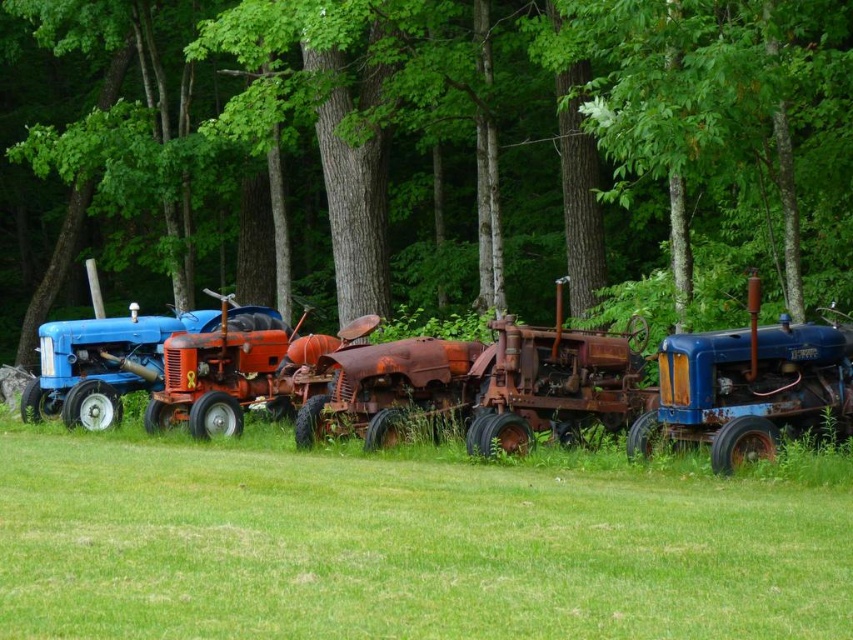
You are a farmer who needs to choose a tractor to plow a narrow field. You have two options in the image, the rusty metal tractor at center and the blue matte tractor at right. Which tractor would you select based on their widths?

The rusty metal tractor at center is thinner than the blue matte tractor at right, so the rusty metal tractor at center would be the better choice for plowing the narrow field as it can fit through tighter spaces.

You are standing in the middle of the grassy area surrounded by trees and looking at the vintage tractors. There are two points marked in the scene, point A at coordinates point (78, 74) and point B at coordinates point (514, 435). Which point is closer to you?

Point A at coordinates point (78, 74) is closer to you because it is further to the camera than point B at coordinates point (514, 435).

You are a farmer who needs to choose between the rusty metal tractor at center and the blue matte tractor at right for a task that requires a taller vehicle. Which tractor should you choose?

The blue matte tractor at right is taller than the rusty metal tractor at center, so you should choose the blue matte tractor at right for the task.